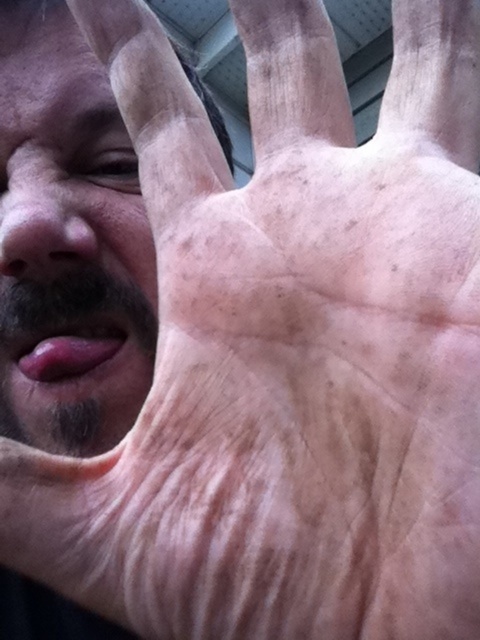
Question: Is smooth skin at left wider than matte skin nose at left?

Choices:
 (A) yes
 (B) no

Answer: (A)

Question: Can you confirm if smooth skin at left is smaller than matte skin nose at left?

Choices:
 (A) no
 (B) yes

Answer: (A)

Question: Considering the relative positions of smooth skin at left and matte skin nose at left in the image provided, where is smooth skin at left located with respect to matte skin nose at left?

Choices:
 (A) above
 (B) below

Answer: (A)

Question: Which of the following is the farthest from the observer?

Choices:
 (A) smooth skin at left
 (B) matte skin nose at left

Answer: (B)